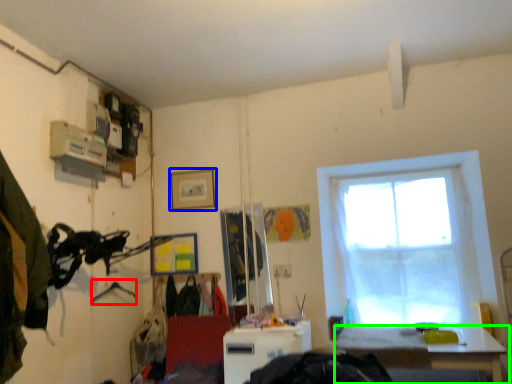
Question: Based on their relative distances, which object is nearer to hanger (highlighted by a red box)? Choose from picture frame (highlighted by a blue box) and table (highlighted by a green box).

Choices:
 (A) picture frame
 (B) table

Answer: (A)